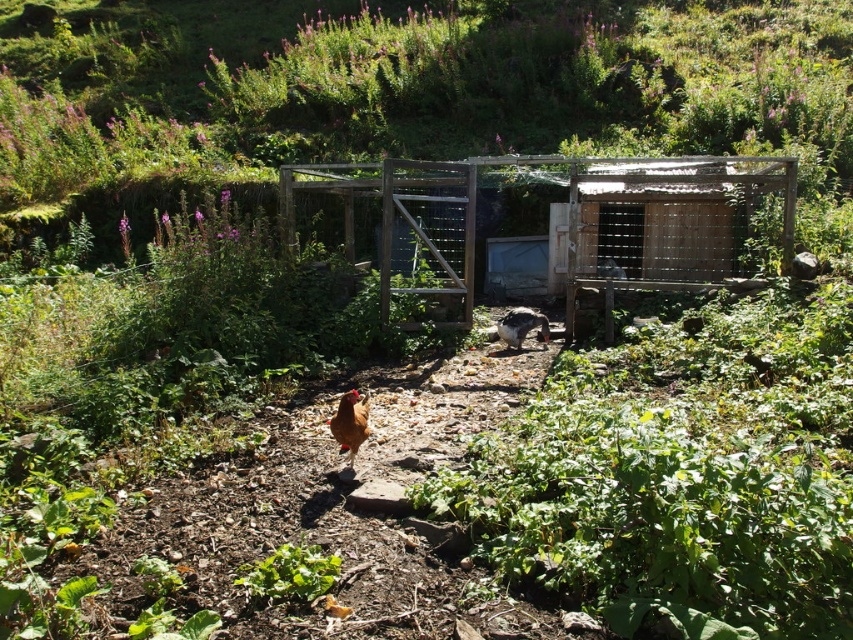
You are a farmer who needs to feed the white glossy chicken at center. The feed is kept in the wooden chicken coop at center. Can you reach the feed without moving from your current position if you can stretch your arm 1.5 meters?

The distance between the wooden chicken coop at center and the white glossy chicken at center is 1.47 meters, which is within your arm stretch of 1.5 meters. Therefore, you can reach the feed without moving.

You are a farmer checking on your animals. You see the wooden chicken coop at center and the brown matte chicken at center. Which one is taller?

The wooden chicken coop at center is taller than the brown matte chicken at center.

You are standing at the starting point and want to reach the wooden structure in the background. There is a chicken at point (350, 422). Is there an obstacle between you and the wooden structure?

The point (350, 422) corresponds to the brown matte chicken at center, which is between you and the wooden structure. Therefore, the chicken is an obstacle between you and the wooden structure.